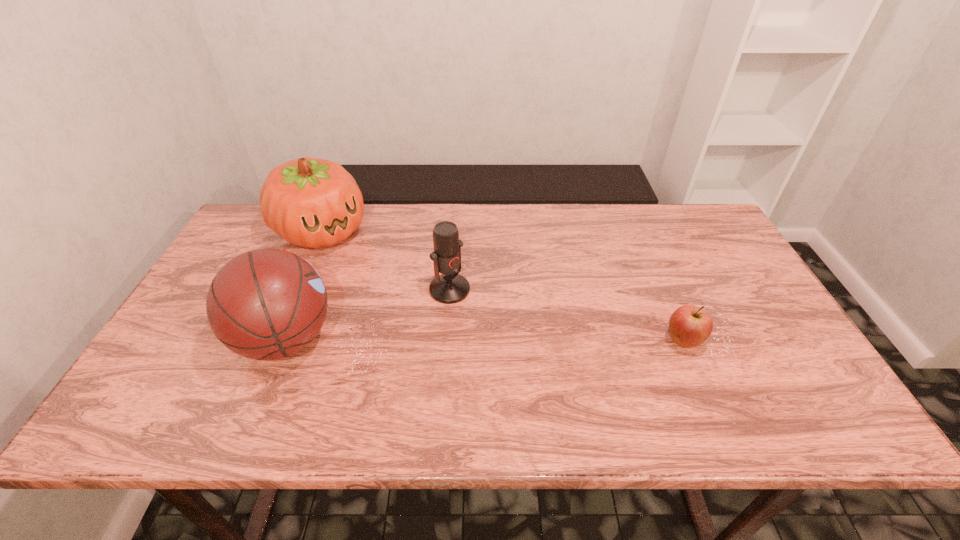
Find the location of `free space between the third tallest object and the farthest object`. free space between the third tallest object and the farthest object is located at coordinates (386, 261).

What are the coordinates of `free space between the apple and the second shortest object` in the screenshot? It's located at (566, 315).

Find the location of `object that is the second closest to the basketball`. object that is the second closest to the basketball is located at coordinates (448, 288).

Find the location of a particular element. Image resolution: width=960 pixels, height=540 pixels. the second closest object to the second object from right to left is located at coordinates (310, 202).

Find the location of a particular element. This screenshot has width=960, height=540. free space that satisfies the following two spatial constraints: 1. on the front side of the rightmost object; 2. on the right side of the microphone is located at coordinates (446, 341).

This screenshot has height=540, width=960. I want to click on free location that satisfies the following two spatial constraints: 1. on the front side of the basketball; 2. on the right side of the pumpkin, so click(x=276, y=339).